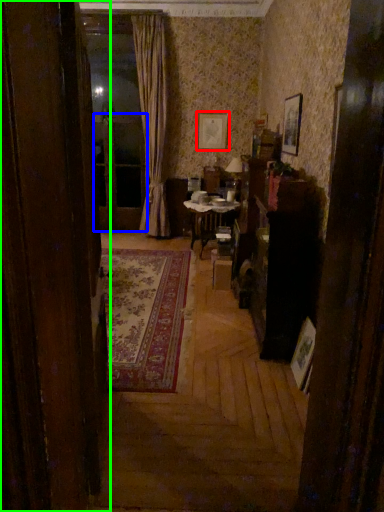
Question: Estimate the real-world distances between objects in this image. Which object is farther from picture frame (highlighted by a red box), screen door (highlighted by a blue box) or door (highlighted by a green box)?

Choices:
 (A) screen door
 (B) door

Answer: (B)